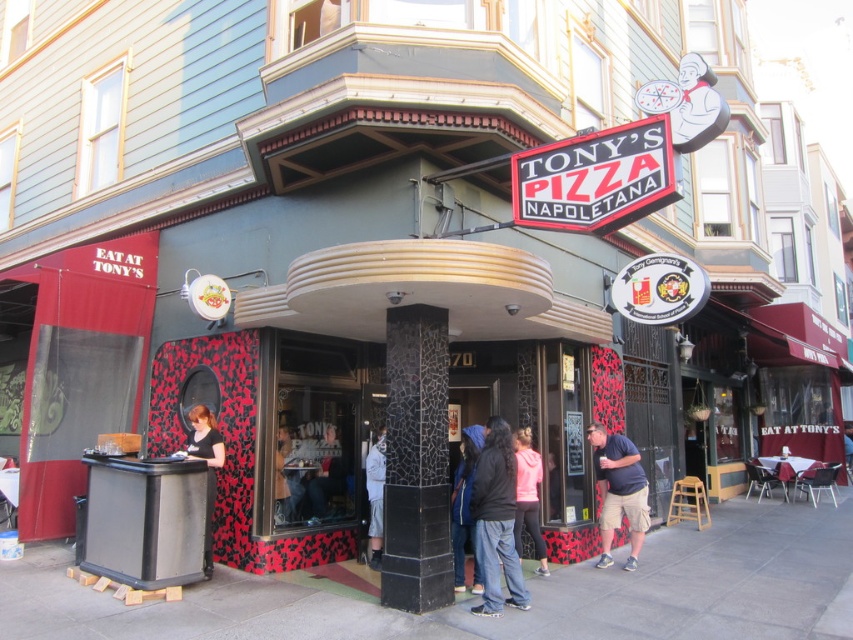
You are a delivery person standing at the entrance of Tony s Pizza Napoletana. You need to place a blue denim jacket at center and a white cotton shirt at center on a shelf that is 1.2 meters wide. Can both items fit side by side on the shelf without overlapping?

The blue denim jacket at center is 1.17 meters away from the white cotton shirt at center. Since the distance between them is less than the shelf s width of 1.2 meters, both items can fit side by side on the shelf without overlapping.

You are a fashion designer looking at the image of Tony s Pizza Napoletana. You see a pink matte jacket at center and a matte black shirt at lower left. Which one is bigger in size?

The pink matte jacket at center is larger in size compared to the matte black shirt at lower left.

You are a delivery person standing at the entrance of Tony s Pizza Napoletana. You need to place a large pizza box that is 70 centimeters wide between the denim pants at center and the pink matte jacket at center. Can the pizza box fit between them without overlapping either object?

The distance between denim pants at center and pink matte jacket at center is 83.40 centimeters. Since the pizza box is 70 centimeters wide, it can fit between them as there is enough space.